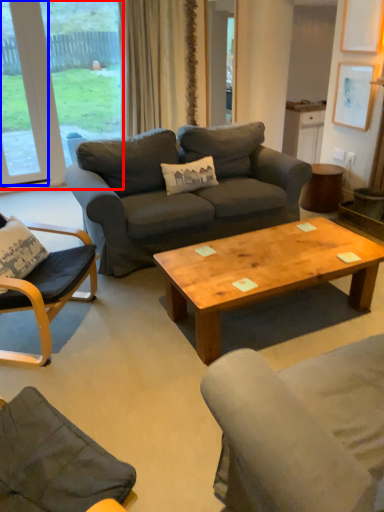
Question: Which object appears farthest to the camera in this image, window (highlighted by a red box) or window (highlighted by a blue box)?

Choices:
 (A) window
 (B) window

Answer: (A)